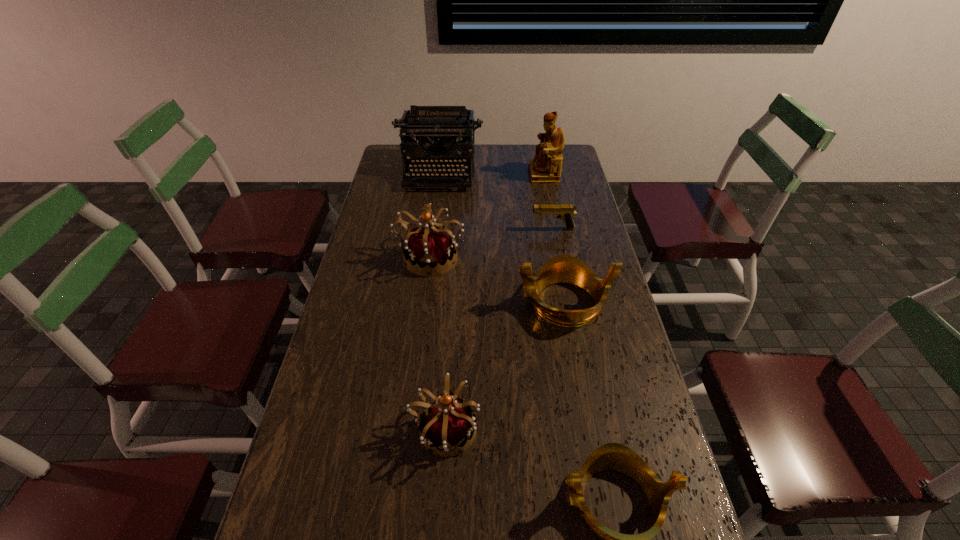
I want to click on vacant position at the left edge of the desktop, so click(371, 222).

The height and width of the screenshot is (540, 960). In the image, there is a desktop. What are the coordinates of `vacant space at the right edge` in the screenshot? It's located at (600, 271).

Where is `free space at the far right corner of the desktop`? free space at the far right corner of the desktop is located at coordinates (573, 153).

Find the location of a particular element. vacant point located between the typewriter and the farther gold tiara is located at coordinates (501, 238).

At what (x,y) coordinates should I click in order to perform the action: click on free spot between the bigger red tiara and the farther gold tiara. Please return your answer as a coordinate pair (x, y). This screenshot has width=960, height=540. Looking at the image, I should click on (497, 280).

This screenshot has height=540, width=960. What are the coordinates of `vacant point located between the bigger red tiara and the bigger gold tiara` in the screenshot? It's located at (497, 280).

The width and height of the screenshot is (960, 540). In order to click on vacant space in between the typewriter and the bigger gold tiara in this screenshot , I will do `click(501, 238)`.

Image resolution: width=960 pixels, height=540 pixels. What are the coordinates of `object that is the sixth closest one to the figurine` in the screenshot? It's located at (612, 456).

Identify which object is the sixth nearest to the nearer red tiara. Please provide its 2D coordinates. Your answer should be formatted as a tuple, i.e. [(x, y)], where the tuple contains the x and y coordinates of a point satisfying the conditions above.

[(546, 166)]

What are the coordinates of `the third closest tiara to the tan pistol` in the screenshot? It's located at [447, 424].